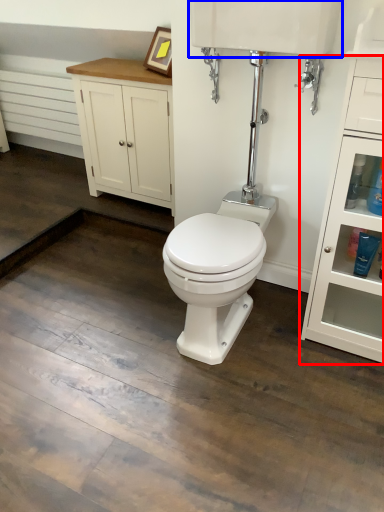
Question: Which object appears closest to the camera in this image, dresser (highlighted by a red box) or sink (highlighted by a blue box)?

Choices:
 (A) dresser
 (B) sink

Answer: (A)